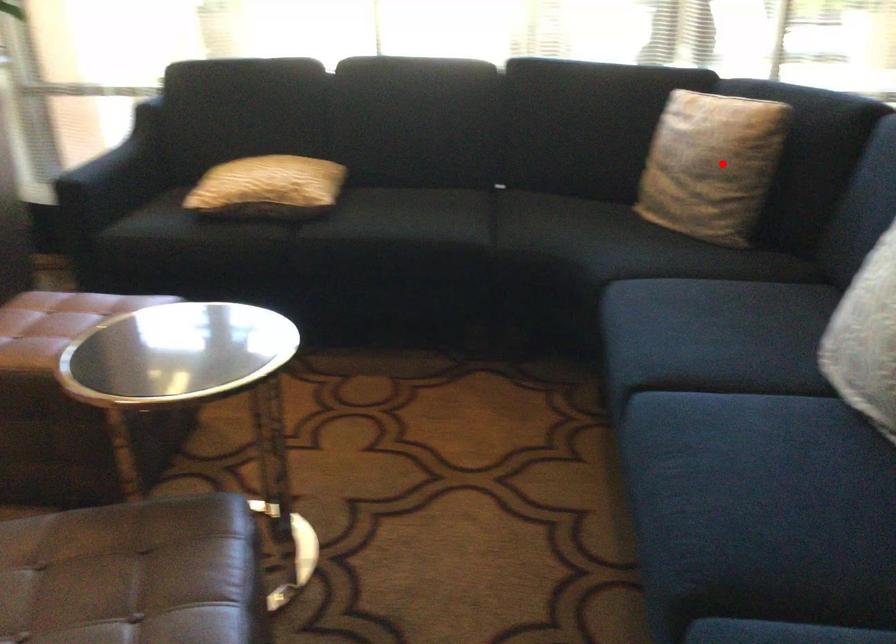
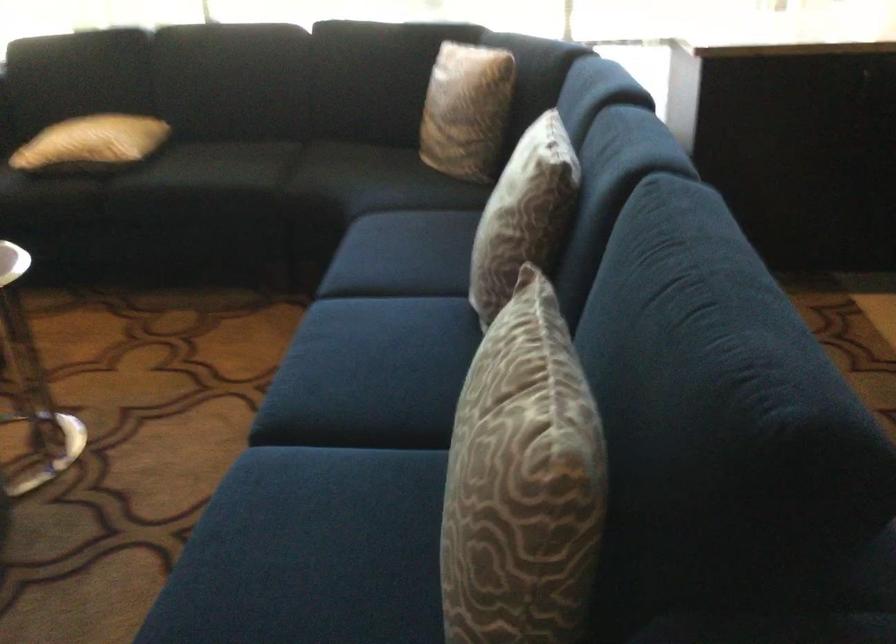
Where in the second image is the point corresponding to the highlighted location from the first image?

(467, 109)